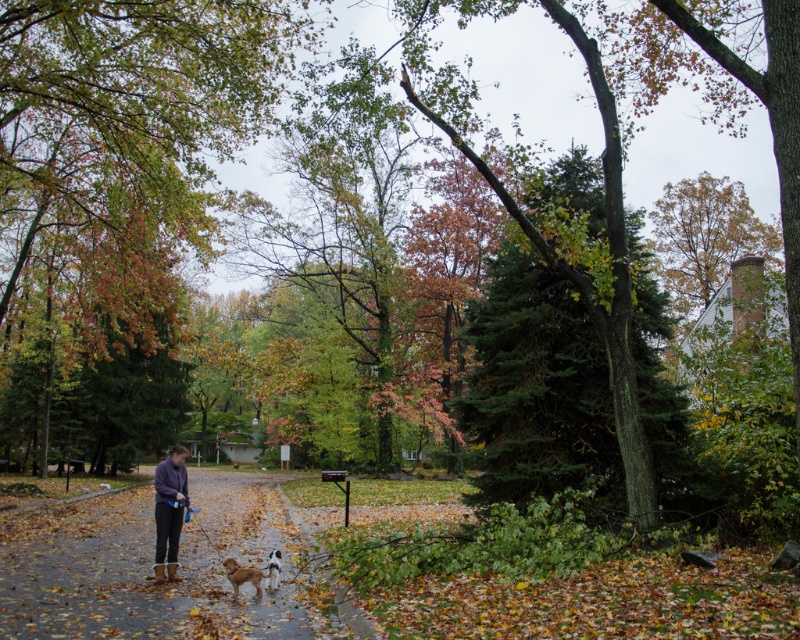
Is matte purple sweater at center to the left of white fur dog at lower center from the viewer's perspective?

Indeed, matte purple sweater at center is positioned on the left side of white fur dog at lower center.

Between matte purple sweater at center and white fur dog at lower center, which one has less height?

With less height is white fur dog at lower center.

Does point (176, 474) come farther from viewer compared to point (270, 576)?

Yes, it is.

I want to click on matte purple sweater at center, so click(169, 512).

In the scene shown: Does dark gray asphalt path at lower left lie in front of golden fur dog at center?

Yes.

Does point (48, 552) come farther from viewer compared to point (228, 570)?

That is True.

Where is `dark gray asphalt path at lower left`? The image size is (800, 640). dark gray asphalt path at lower left is located at coordinates (152, 566).

Is point (236, 589) positioned in front of point (272, 556)?

Yes.

Is golden fur dog at center behind white fur dog at lower center?

No, golden fur dog at center is closer to the viewer.

Describe the element at coordinates (242, 576) in the screenshot. I see `golden fur dog at center` at that location.

I want to click on golden fur dog at center, so click(242, 576).